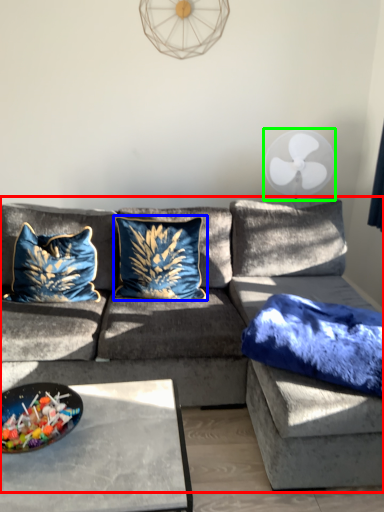
Question: Considering the real-world distances, which object is closest to studio couch (highlighted by a red box)? pillow (highlighted by a blue box) or mechanical fan (highlighted by a green box).

Choices:
 (A) pillow
 (B) mechanical fan

Answer: (A)